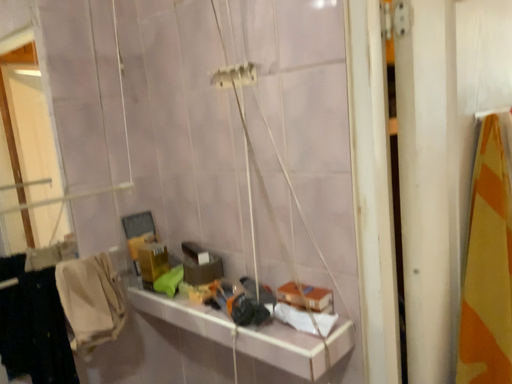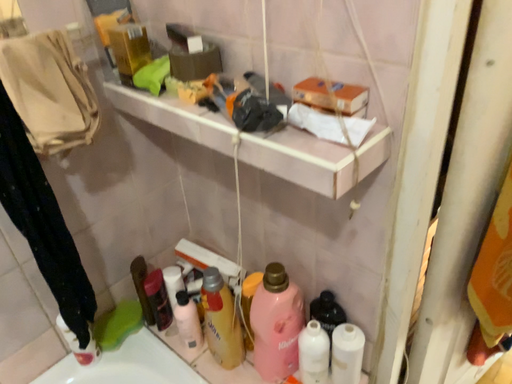
Question: How did the camera likely rotate when shooting the video?

Choices:
 (A) rotated downward
 (B) rotated upward

Answer: (A)